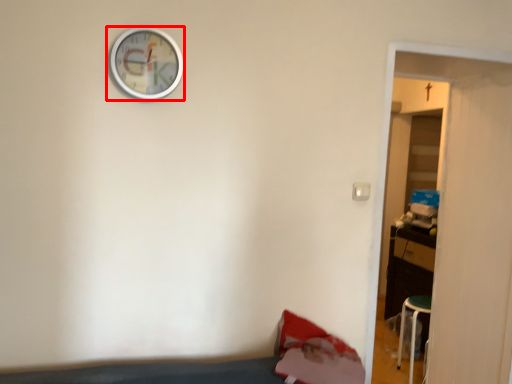
Question: From the image, what is the correct spatial relationship of wall clock (annotated by the red box) in relation to door?

Choices:
 (A) right
 (B) left

Answer: (B)